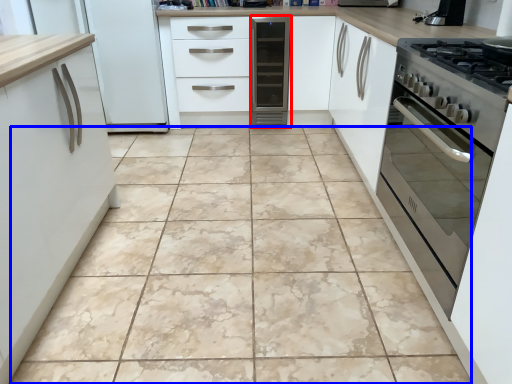
Question: Which point is further to the camera, home appliance (highlighted by a red box) or ceramic tile (highlighted by a blue box)?

Choices:
 (A) home appliance
 (B) ceramic tile

Answer: (A)